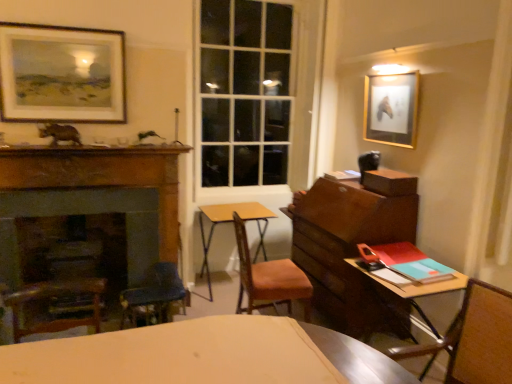
Question: Is the depth of wooden chair at center, the first chair positioned from the back, greater than that of wooden desk at right, the first table positioned from the right?

Choices:
 (A) no
 (B) yes

Answer: (B)

Question: From the image's perspective, is wooden chair at center, which is the 2th chair in front-to-back order, above wooden desk at right, which is the 2th table from back to front?

Choices:
 (A) no
 (B) yes

Answer: (B)

Question: Is wooden chair at center, the first chair when ordered from left to right, in front of wooden desk at right, which is the 2th table from back to front?

Choices:
 (A) no
 (B) yes

Answer: (A)

Question: From the image's perspective, is wooden chair at center, which is counted as the second chair, starting from the right, below wooden desk at right, which is the first table in front-to-back order?

Choices:
 (A) yes
 (B) no

Answer: (B)

Question: Does wooden chair at center, which is the 2th chair in front-to-back order, have a greater height compared to wooden desk at right, which ranks as the second table in left-to-right order?

Choices:
 (A) yes
 (B) no

Answer: (A)

Question: Is gold-framed picture at upper right, arranged as the first picture frame when viewed from the right, in contact with matte black picture frame at upper left, marked as the 2th picture frame in a right-to-left arrangement?

Choices:
 (A) no
 (B) yes

Answer: (A)

Question: Is gold-framed picture at upper right, arranged as the first picture frame when viewed from the right, positioned with its back to matte black picture frame at upper left, marked as the 2th picture frame in a right-to-left arrangement?

Choices:
 (A) yes
 (B) no

Answer: (B)

Question: Are gold-framed picture at upper right, arranged as the first picture frame when viewed from the right, and matte black picture frame at upper left, marked as the 2th picture frame in a right-to-left arrangement, located far from each other?

Choices:
 (A) no
 (B) yes

Answer: (B)

Question: Can you confirm if gold-framed picture at upper right, the second picture frame positioned from the left, is thinner than matte black picture frame at upper left, which is the 1th picture frame from left to right?

Choices:
 (A) yes
 (B) no

Answer: (A)

Question: Can matte black picture frame at upper left, which is the 1th picture frame from left to right, be found inside gold-framed picture at upper right, arranged as the first picture frame when viewed from the right?

Choices:
 (A) yes
 (B) no

Answer: (B)

Question: From a real-world perspective, is gold-framed picture at upper right, arranged as the first picture frame when viewed from the right, positioned under matte black picture frame at upper left, which is the 1th picture frame from left to right, based on gravity?

Choices:
 (A) no
 (B) yes

Answer: (B)

Question: Are teal matte book at right and yellow wood table at center, which appears as the 2th table when viewed from the right, far apart?

Choices:
 (A) yes
 (B) no

Answer: (A)